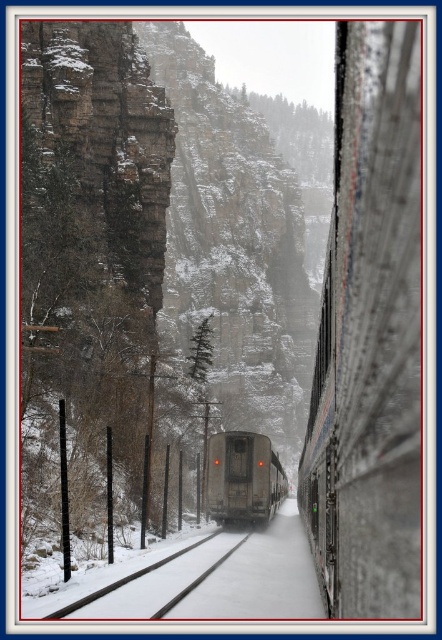
Can you confirm if gray metallic train at center is positioned below snow-covered metal track at center?

Correct, gray metallic train at center is located below snow-covered metal track at center.

What do you see at coordinates (243, 477) in the screenshot? The height and width of the screenshot is (640, 442). I see `gray metallic train at center` at bounding box center [243, 477].

Does point (227, 493) lie behind point (118, 582)?

Yes, it is.

The height and width of the screenshot is (640, 442). I want to click on gray metallic train at center, so click(x=243, y=477).